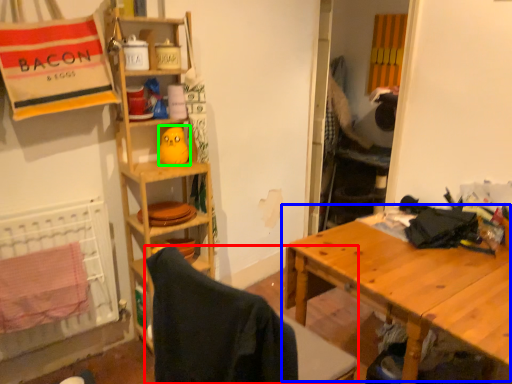
Question: Which is nearer to the folding chair (highlighted by a red box)? table (highlighted by a blue box) or toy (highlighted by a green box).

Choices:
 (A) table
 (B) toy

Answer: (A)